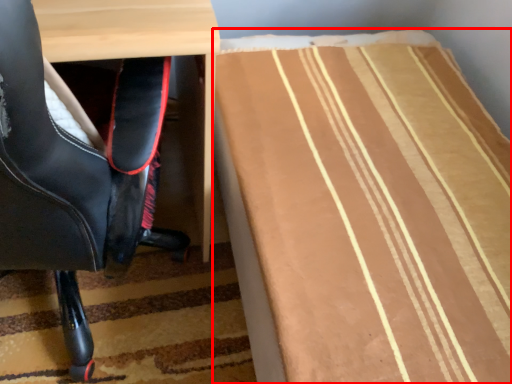
Question: From the image's perspective, where is table (annotated by the red box) located in relation to chair in the image?

Choices:
 (A) below
 (B) above

Answer: (A)